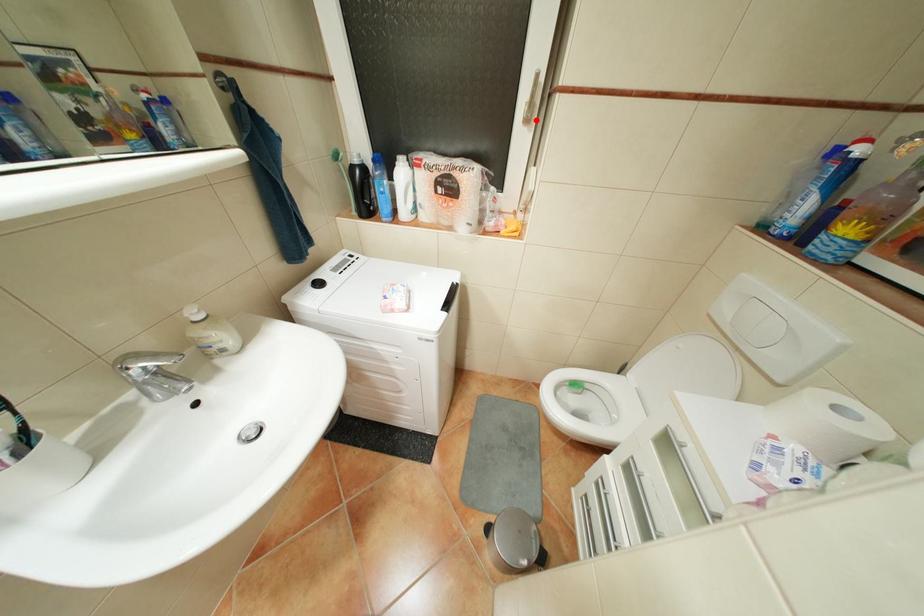
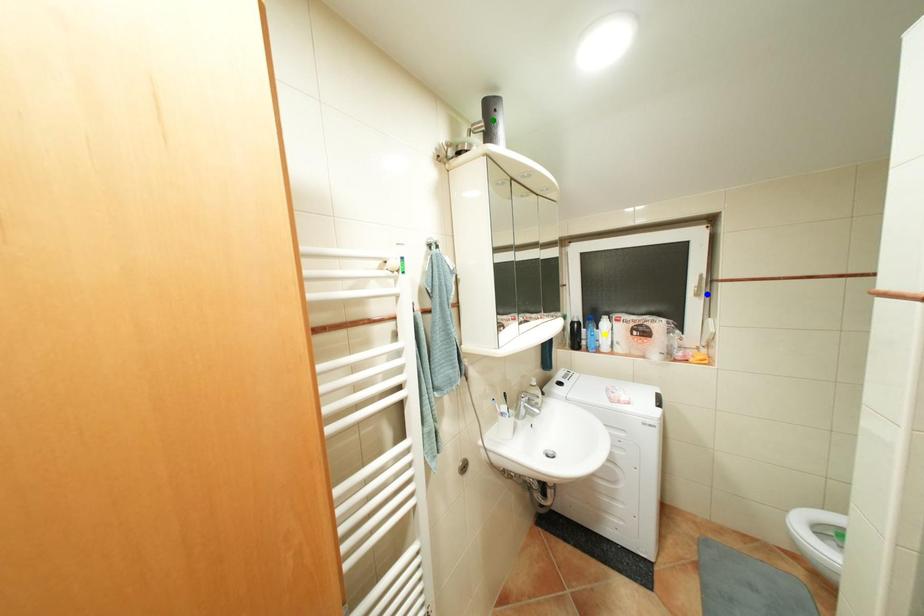
Question: I am providing you with two images of the same scene from different viewpoints. A red point is marked on the first image. You are given multiple points on the second image. Which point in image 2 is actually the same real-world point as the red point in image 1?

Choices:
 (A) yellow point
 (B) green point
 (C) blue point

Answer: (C)